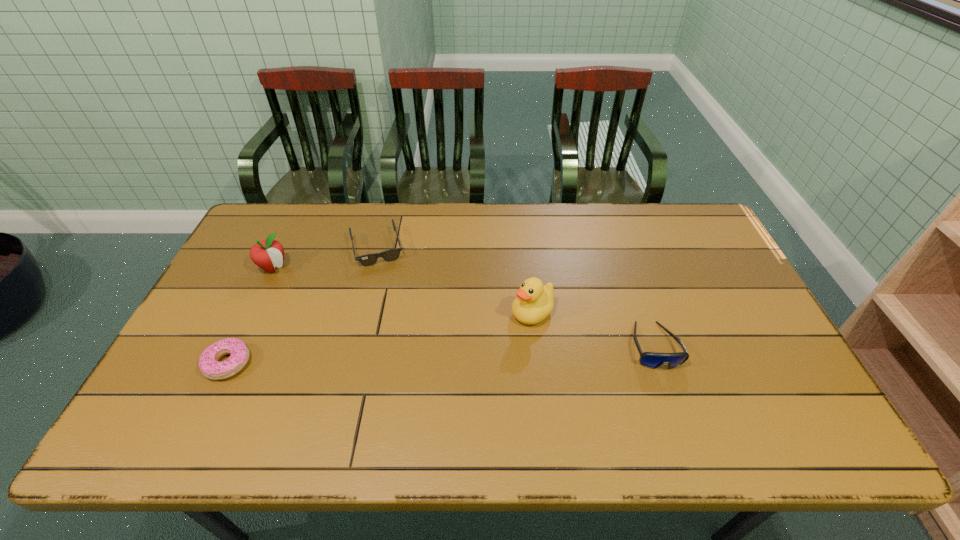
I want to click on doughnut that is at the left edge, so click(x=209, y=364).

Where is `apple that is at the left edge`? The width and height of the screenshot is (960, 540). apple that is at the left edge is located at coordinates (267, 254).

Locate an element on the screen. The image size is (960, 540). object present at the near left corner is located at coordinates (209, 364).

Where is `vacant space at the far edge`? vacant space at the far edge is located at coordinates (516, 215).

In order to click on free space at the near edge in this screenshot , I will do `click(432, 386)`.

The width and height of the screenshot is (960, 540). I want to click on free space at the left edge, so click(255, 277).

You are a GUI agent. You are given a task and a screenshot of the screen. Output one action in this format:
    pyautogui.click(x=<x>, y=<y>)
    Task: Click on the vacant space at the right edge of the desktop
    The image size is (960, 540).
    Given the screenshot: What is the action you would take?
    pyautogui.click(x=706, y=305)

You are a GUI agent. You are given a task and a screenshot of the screen. Output one action in this format:
    pyautogui.click(x=<x>, y=<y>)
    Task: Click on the free space at the far left corner
    
    Given the screenshot: What is the action you would take?
    [280, 217]

You are a GUI agent. You are given a task and a screenshot of the screen. Output one action in this format:
    pyautogui.click(x=<x>, y=<y>)
    Task: Click on the free space between the doughnut and the duck
    
    Given the screenshot: What is the action you would take?
    pyautogui.click(x=380, y=338)

Locate an element on the screen. free space between the apple and the duck is located at coordinates pyautogui.click(x=403, y=290).